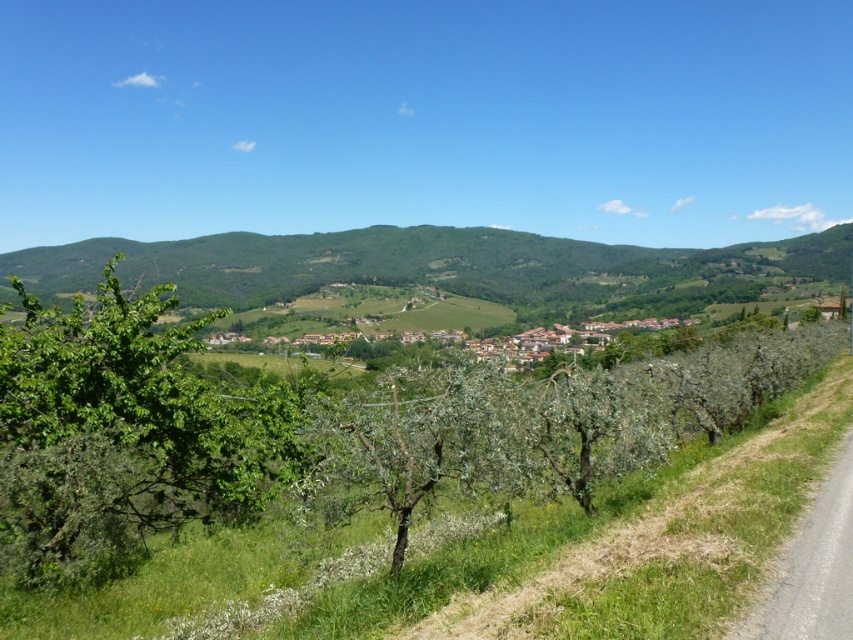
Does green leafy tree at left have a smaller size compared to brown clay houses at center?

Indeed, green leafy tree at left has a smaller size compared to brown clay houses at center.

Where is `green leafy tree at left`? green leafy tree at left is located at coordinates (122, 435).

Image resolution: width=853 pixels, height=640 pixels. Describe the element at coordinates (122, 435) in the screenshot. I see `green leafy tree at left` at that location.

Locate an element on the screen. The height and width of the screenshot is (640, 853). green leafy tree at left is located at coordinates (122, 435).

Does green leafy tree at left have a greater height compared to green leafy hillside at center?

In fact, green leafy tree at left may be shorter than green leafy hillside at center.

Does green leafy tree at left have a larger size compared to green leafy hillside at center?

Incorrect, green leafy tree at left is not larger than green leafy hillside at center.

The width and height of the screenshot is (853, 640). In order to click on green leafy tree at left in this screenshot , I will do click(122, 435).

In the scene shown: Can you confirm if green leafy hillside at center is shorter than brown clay houses at center?

Incorrect, green leafy hillside at center's height does not fall short of brown clay houses at center's.

Is green leafy hillside at center closer to camera compared to brown clay houses at center?

No, green leafy hillside at center is further to the viewer.

The width and height of the screenshot is (853, 640). I want to click on green leafy hillside at center, so click(436, 266).